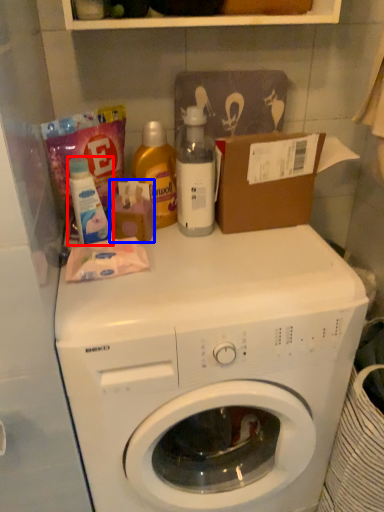
Question: Which object appears farthest to the camera in this image, cleaning product (highlighted by a red box) or toiletry (highlighted by a blue box)?

Choices:
 (A) cleaning product
 (B) toiletry

Answer: (B)